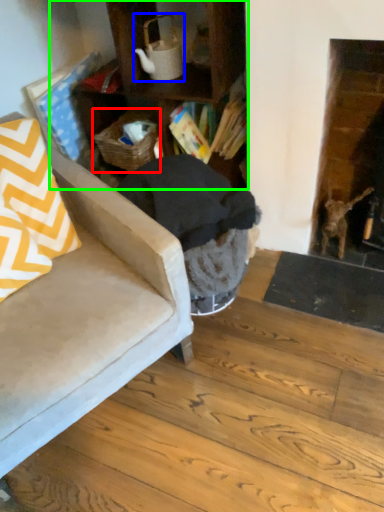
Question: Estimate the real-world distances between objects in this image. Which object is closer to basket (highlighted by a red box), tea pot (highlighted by a blue box) or cabinetry (highlighted by a green box)?

Choices:
 (A) tea pot
 (B) cabinetry

Answer: (B)